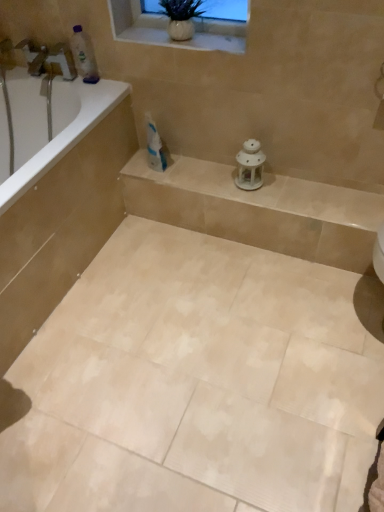
Locate an element on the screen. The image size is (384, 512). white ceramic vase at upper center is located at coordinates (167, 29).

At what (x,y) coordinates should I click in order to perform the action: click on translucent plastic bottle at upper left. Please return your answer as a coordinate pair (x, y). This screenshot has width=384, height=512. Looking at the image, I should click on (84, 56).

The height and width of the screenshot is (512, 384). I want to click on white glossy bathtub at upper left, so click(47, 125).

In order to face white glossy bathtub at left, should I rotate leftwards or rightwards?

You should rotate left by 24.269 degrees.

At what (x,y) coordinates should I click in order to perform the action: click on white ceramic vase at upper center. Please return your answer as a coordinate pair (x, y). Looking at the image, I should click on (167, 29).

Based on their sizes in the image, would you say white glossy bathtub at upper left is bigger or smaller than beige ceramic tile at center?

In the image, white glossy bathtub at upper left appears to be smaller than beige ceramic tile at center.

From a real-world perspective, is white glossy bathtub at upper left physically above beige ceramic tile at center?

Correct, in the physical world, white glossy bathtub at upper left is higher than beige ceramic tile at center.

From their relative heights in the image, would you say white glossy bathtub at upper left is taller or shorter than beige ceramic tile at center?

In the image, white glossy bathtub at upper left appears to be taller than beige ceramic tile at center.

Is white glossy bathtub at upper left looking in the opposite direction of beige ceramic tile at center?

No, beige ceramic tile at center is not at the back of white glossy bathtub at upper left.

Is point (249, 158) closer or farther from the camera than point (18, 315)?

Clearly, point (249, 158) is more distant from the camera than point (18, 315).

Can you confirm if white porcelain lantern at center is wider than white glossy bathtub at left?

Incorrect, the width of white porcelain lantern at center does not surpass that of white glossy bathtub at left.

From the image's perspective, between white porcelain lantern at center and white glossy bathtub at left, which one is located above?

white porcelain lantern at center is shown above in the image.

Image resolution: width=384 pixels, height=512 pixels. I want to click on bath located underneath the white glossy toothpaste at center (from a real-world perspective), so tap(61, 206).

Which of these two, white glossy bathtub at left or white glossy toothpaste at center, stands taller?

Answer: With more height is white glossy bathtub at left.

Considering the relative sizes of white glossy bathtub at left and white glossy toothpaste at center in the image provided, is white glossy bathtub at left wider than white glossy toothpaste at center?

Correct, the width of white glossy bathtub at left exceeds that of white glossy toothpaste at center.

Could you tell me if white glossy bathtub at left is turned towards white glossy toothpaste at center?

Yes, white glossy bathtub at left is aimed at white glossy toothpaste at center.

How different are the orientations of white ceramic vase at upper center and white porcelain lantern at center in degrees?

2.86e-05 degrees.

Considering the relative sizes of white ceramic vase at upper center and white porcelain lantern at center in the image provided, is white ceramic vase at upper center thinner than white porcelain lantern at center?

Incorrect, the width of white ceramic vase at upper center is not less than that of white porcelain lantern at center.

Based on the photo, could you tell me if white ceramic vase at upper center is facing white porcelain lantern at center?

No, white ceramic vase at upper center is not aimed at white porcelain lantern at center.

From the image's perspective, is white ceramic vase at upper center above or below white porcelain lantern at center?

Clearly, from the image's perspective, white ceramic vase at upper center is above white porcelain lantern at center.

Between point (249, 144) and point (349, 259), which one is positioned in front?

The point (249, 144) is closer to the camera.

Is white ceramic lantern at center at the back of white porcelain lantern at center?

white porcelain lantern at center does not have its back to white ceramic lantern at center.

Based on the photo, from the image's perspective, which is above, white porcelain lantern at center or white ceramic lantern at center?

white porcelain lantern at center is shown above in the image.

Is white ceramic lantern at center to the right of white glossy toothpaste at center from the viewer's perspective?

Correct, you'll find white ceramic lantern at center to the right of white glossy toothpaste at center.

Is white ceramic lantern at center oriented towards white glossy toothpaste at center?

No, white ceramic lantern at center is not aimed at white glossy toothpaste at center.

In the scene shown: From the image's perspective, which object appears higher, white ceramic lantern at center or white glossy toothpaste at center?

white glossy toothpaste at center.

Which object is closer to the camera taking this photo, white glossy bathtub at upper left or white porcelain lantern at center?

white glossy bathtub at upper left is in front.

Would you say white glossy bathtub at upper left is to the left or to the right of white porcelain lantern at center in the picture?

Based on their positions, white glossy bathtub at upper left is located to the left of white porcelain lantern at center.

Is white glossy bathtub at upper left shorter than white porcelain lantern at center?

Incorrect, the height of white glossy bathtub at upper left does not fall short of that of white porcelain lantern at center.

Is white glossy bathtub at upper left positioned beyond the bounds of white porcelain lantern at center?

Yes, white glossy bathtub at upper left is not within white porcelain lantern at center.

Locate an element on the screen. This screenshot has height=512, width=384. ceramic tile lying in front of the white glossy bathtub at upper left is located at coordinates (194, 384).

Locate an element on the screen. This screenshot has height=512, width=384. porcelain that appears above the white glossy bathtub at left (from a real-world perspective) is located at coordinates (250, 165).

Which object lies further to the anchor point beige ceramic tile at center, white porcelain lantern at center or white glossy bathtub at left?

The object further to beige ceramic tile at center is white porcelain lantern at center.

Which object lies nearer to the anchor point beige ceramic tile at center, white glossy toothpaste at center or white glossy bathtub at left?

white glossy bathtub at left is positioned closer to the anchor beige ceramic tile at center.

Considering their positions, is beige ceramic tile at center positioned closer to white glossy bathtub at left than white glossy toothpaste at center?

white glossy toothpaste at center lies closer to white glossy bathtub at left than the other object.

Which object lies nearer to the anchor point white glossy bathtub at left, translucent plastic bottle at upper left or white ceramic vase at upper center?

translucent plastic bottle at upper left is positioned closer to the anchor white glossy bathtub at left.

Looking at this image, based on their spatial positions, is white porcelain lantern at center or white glossy bathtub at left further from white glossy bathtub at upper left?

white porcelain lantern at center is positioned further to the anchor white glossy bathtub at upper left.

Looking at the image, which one is located further to white glossy toothpaste at center, white glossy bathtub at upper left or white porcelain lantern at center?

Answer: white glossy bathtub at upper left.

When comparing their distances from translucent plastic bottle at upper left, does white porcelain lantern at center or beige ceramic tile at center seem further?

beige ceramic tile at center is further to translucent plastic bottle at upper left.

Looking at the image, which one is located closer to translucent plastic bottle at upper left, white glossy bathtub at left or beige ceramic tile at center?

Among the two, white glossy bathtub at left is located nearer to translucent plastic bottle at upper left.

At what (x,y) coordinates should I click in order to perform the action: click on balustrade between white glossy toothpaste at center and beige ceramic tile at center from top to bottom. Please return your answer as a coordinate pair (x, y). Looking at the image, I should click on (258, 210).

I want to click on window frame between translucent plastic bottle at upper left and white porcelain lantern at center in the horizontal direction, so click(167, 29).

The image size is (384, 512). I want to click on bathtub between white glossy bathtub at left and white porcelain lantern at center from left to right, so click(x=47, y=125).

The width and height of the screenshot is (384, 512). I want to click on balustrade located between white glossy toothpaste at center and white porcelain lantern at center in the left-right direction, so click(258, 210).